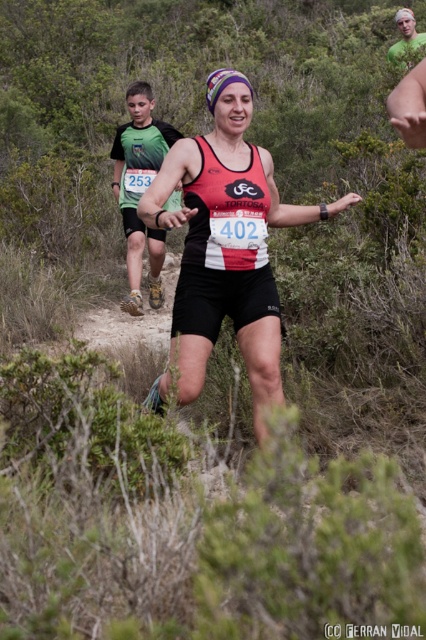
Question: Among these objects, which one is nearest to the camera?

Choices:
 (A) matte black tank top at center
 (B) blonde hair at upper right

Answer: (A)

Question: Among these objects, which one is farthest from the camera?

Choices:
 (A) matte black tank top at center
 (B) blonde hair at upper right

Answer: (B)

Question: Where is matte black tank top at center located in relation to green fabric shirt at left in the image?

Choices:
 (A) left
 (B) right

Answer: (B)

Question: Does green fabric shirt at left lie in front of blonde hair at upper right?

Choices:
 (A) no
 (B) yes

Answer: (B)

Question: Estimate the real-world distances between objects in this image. Which object is farther from the blonde hair at upper right?

Choices:
 (A) green fabric shirt at left
 (B) matte black tank top at center

Answer: (B)

Question: Can you confirm if green fabric shirt at left is positioned to the left of blonde hair at upper right?

Choices:
 (A) no
 (B) yes

Answer: (B)